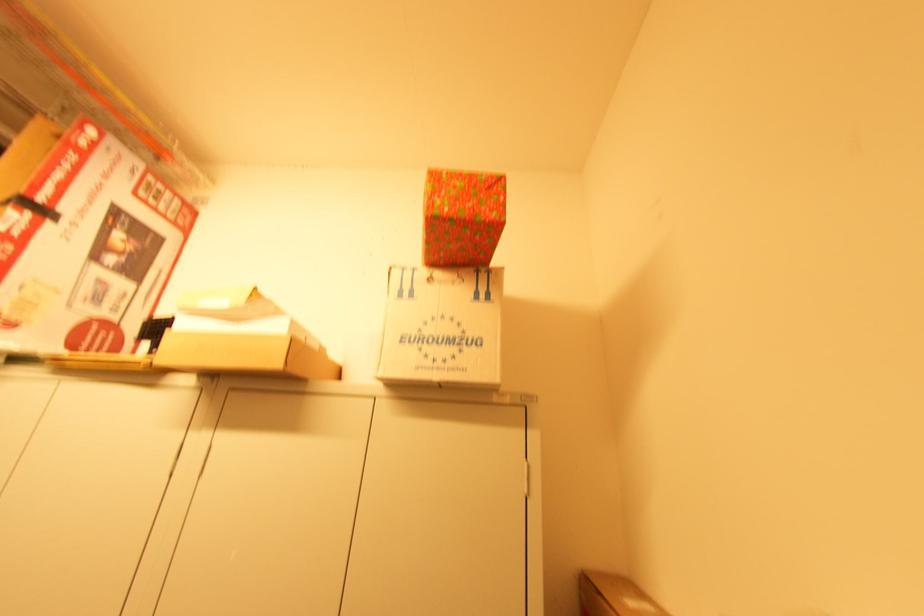
This screenshot has height=616, width=924. Find the location of `large red box`. large red box is located at coordinates (81, 249).